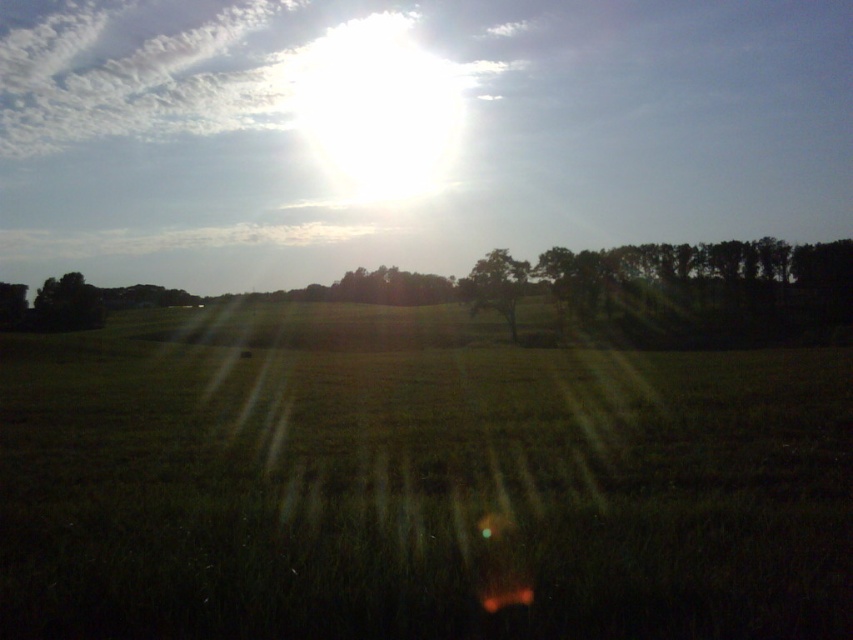
You are standing in the middle of the field in the rural landscape scene. You see two points marked on the ground. One is at point (831,429) and the other is at point (86,289). Which point is closer to you?

Point (831,429) is in front of point (86,289), so it is closer to you.

You are an artist painting the landscape. You want to accurately depict the relative sizes of the green leafy tree at center and the dark green leafy tree at left. Which tree should you paint as the smaller one?

You should paint the green leafy tree at center as the smaller one because it is smaller than the dark green leafy tree at left according to the description.

You are standing in the middle of the grassy field in the rural landscape. There is a point marked at coordinates (415, 483). What is the color of the grass at that point?

The green grass at center is represented by point (415, 483), so the color is green.